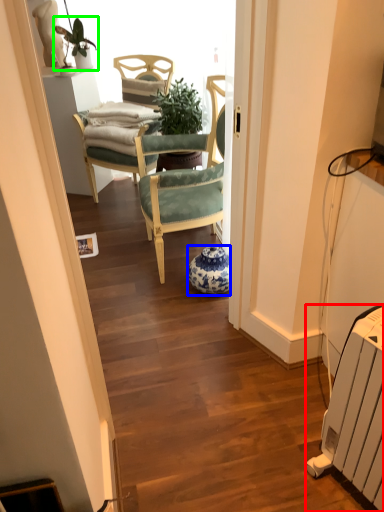
Question: Which object is positioned closest to radiator (highlighted by a red box)? Select from vase (highlighted by a blue box) and houseplant (highlighted by a green box).

Choices:
 (A) vase
 (B) houseplant

Answer: (A)